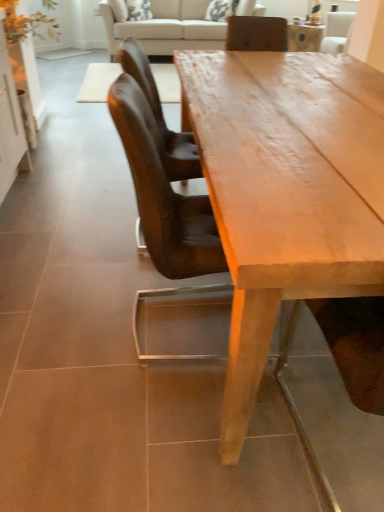
What do you see at coordinates (164, 27) in the screenshot? I see `beige fabric couch at upper center` at bounding box center [164, 27].

What do you see at coordinates (161, 116) in the screenshot? The width and height of the screenshot is (384, 512). I see `leather chair at center, which appears as the 2th chair when viewed from the front` at bounding box center [161, 116].

Describe the element at coordinates (10, 124) in the screenshot. I see `white glossy cabinet at left` at that location.

Locate an element on the screen. This screenshot has width=384, height=512. beige fabric couch at upper center is located at coordinates (164, 27).

Who is shorter, smooth wooden table at center or white glossy cabinet at left?

Standing shorter between the two is smooth wooden table at center.

This screenshot has width=384, height=512. What are the coordinates of `cabinetry above the smooth wooden table at center (from the image's perspective)` in the screenshot? It's located at (10, 124).

Considering the sizes of smooth wooden table at center and white glossy cabinet at left in the image, is smooth wooden table at center wider or thinner than white glossy cabinet at left?

In the image, smooth wooden table at center appears to be wider than white glossy cabinet at left.

Considering the relative sizes of smooth wooden table at center and white glossy cabinet at left in the image provided, is smooth wooden table at center smaller than white glossy cabinet at left?

Actually, smooth wooden table at center might be larger than white glossy cabinet at left.

Considering the relative sizes of brown leather chair at center, which is counted as the 1th chair, starting from the front, and leather chair at center, which appears as the 2th chair when viewed from the front, in the image provided, is brown leather chair at center, which is counted as the 1th chair, starting from the front, wider than leather chair at center, which appears as the 2th chair when viewed from the front,?

Incorrect, the width of brown leather chair at center, which is counted as the 1th chair, starting from the front, does not surpass that of leather chair at center, which appears as the 2th chair when viewed from the front.

From a real-world perspective, who is located higher, brown leather chair at center, which is counted as the 1th chair, starting from the front, or leather chair at center, positioned as the 1th chair in back-to-front order?

brown leather chair at center, which is counted as the 1th chair, starting from the front, from a real-world perspective.

At what (x,y) coordinates should I click in order to perform the action: click on chair that is on the right side of leather chair at center, positioned as the 1th chair in back-to-front order. Please return your answer as a coordinate pair (x, y). The width and height of the screenshot is (384, 512). Looking at the image, I should click on (163, 193).

Consider the image. Is brown leather chair at center, marked as the second chair in a back-to-front arrangement, in contact with white glossy cabinet at left?

No, brown leather chair at center, marked as the second chair in a back-to-front arrangement, is not beside white glossy cabinet at left.

From the image's perspective, is brown leather chair at center, which is counted as the 1th chair, starting from the front, below white glossy cabinet at left?

Yes.

Looking at their sizes, would you say brown leather chair at center, marked as the second chair in a back-to-front arrangement, is wider or thinner than white glossy cabinet at left?

Considering their sizes, brown leather chair at center, marked as the second chair in a back-to-front arrangement, looks broader than white glossy cabinet at left.

Is white glossy cabinet at left completely or partially inside brown leather chair at center, which is counted as the 1th chair, starting from the front?

No, white glossy cabinet at left is not a part of brown leather chair at center, which is counted as the 1th chair, starting from the front.

Can we say leather chair at center, positioned as the 1th chair in back-to-front order, lies outside brown leather chair at center, marked as the second chair in a back-to-front arrangement?

Yes.

Looking at this image, from a real-world perspective, which object rests below the other?

leather chair at center, which appears as the 2th chair when viewed from the front.

Is leather chair at center, which appears as the 2th chair when viewed from the front, placed right next to brown leather chair at center, which is counted as the 1th chair, starting from the front?

There is a gap between leather chair at center, which appears as the 2th chair when viewed from the front, and brown leather chair at center, which is counted as the 1th chair, starting from the front.

Considering the sizes of objects leather chair at center, positioned as the 1th chair in back-to-front order, and brown leather chair at center, marked as the second chair in a back-to-front arrangement, in the image provided, who is bigger, leather chair at center, positioned as the 1th chair in back-to-front order, or brown leather chair at center, marked as the second chair in a back-to-front arrangement,?

With larger size is brown leather chair at center, marked as the second chair in a back-to-front arrangement.

From a real-world perspective, is beige fabric couch at upper center under white glossy cabinet at left?

Yes, from a real-world perspective, beige fabric couch at upper center is under white glossy cabinet at left.

Consider the image. Is beige fabric couch at upper center further to camera compared to white glossy cabinet at left?

Yes, beige fabric couch at upper center is further from the viewer.

Considering the sizes of objects beige fabric couch at upper center and white glossy cabinet at left in the image provided, who is bigger, beige fabric couch at upper center or white glossy cabinet at left?

With larger size is beige fabric couch at upper center.

Is beige fabric couch at upper center turned away from white glossy cabinet at left?

No, white glossy cabinet at left is not at the back of beige fabric couch at upper center.

From a real-world perspective, is leather chair at center, which appears as the 2th chair when viewed from the front, over beige fabric couch at upper center?

Yes, from a real-world perspective, leather chair at center, which appears as the 2th chair when viewed from the front, is above beige fabric couch at upper center.

Considering the positions of points (143, 57) and (220, 28), is point (143, 57) closer to camera compared to point (220, 28)?

Yes.

Do you think leather chair at center, positioned as the 1th chair in back-to-front order, is within beige fabric couch at upper center, or outside of it?

leather chair at center, positioned as the 1th chair in back-to-front order, lies outside beige fabric couch at upper center.

Who is smaller, leather chair at center, which appears as the 2th chair when viewed from the front, or beige fabric couch at upper center?

leather chair at center, which appears as the 2th chair when viewed from the front, is smaller.

From a real-world perspective, is leather chair at center, positioned as the 1th chair in back-to-front order, positioned under smooth wooden table at center based on gravity?

No, from a real-world perspective, leather chair at center, positioned as the 1th chair in back-to-front order, is not below smooth wooden table at center.

Is smooth wooden table at center a part of leather chair at center, which appears as the 2th chair when viewed from the front?

Definitely not — smooth wooden table at center is not inside leather chair at center, which appears as the 2th chair when viewed from the front.

How much distance is there between leather chair at center, positioned as the 1th chair in back-to-front order, and smooth wooden table at center?

leather chair at center, positioned as the 1th chair in back-to-front order, is 19.73 inches away from smooth wooden table at center.

Which of these two, leather chair at center, positioned as the 1th chair in back-to-front order, or smooth wooden table at center, is smaller?

leather chair at center, positioned as the 1th chair in back-to-front order.

Locate an element on the screen. cabinetry on the left of smooth wooden table at center is located at coordinates (10, 124).

Locate an element on the screen. The width and height of the screenshot is (384, 512). chair located above the brown leather chair at center, which is counted as the 1th chair, starting from the front (from the image's perspective) is located at coordinates (161, 116).

Looking at the image, which one is located further to white glossy cabinet at left, leather chair at center, positioned as the 1th chair in back-to-front order, or smooth wooden table at center?

smooth wooden table at center.

When comparing their distances from white glossy cabinet at left, does brown leather chair at center, marked as the second chair in a back-to-front arrangement, or beige fabric couch at upper center seem further?

beige fabric couch at upper center is positioned further to the anchor white glossy cabinet at left.

From the image, which object appears to be nearer to smooth wooden table at center, white glossy cabinet at left or leather chair at center, which appears as the 2th chair when viewed from the front?

leather chair at center, which appears as the 2th chair when viewed from the front, is closer to smooth wooden table at center.

Estimate the real-world distances between objects in this image. Which object is closer to smooth wooden table at center, leather chair at center, which appears as the 2th chair when viewed from the front, or white glossy cabinet at left?

leather chair at center, which appears as the 2th chair when viewed from the front, is positioned closer to the anchor smooth wooden table at center.

Looking at the image, which one is located further to brown leather chair at center, marked as the second chair in a back-to-front arrangement, leather chair at center, which appears as the 2th chair when viewed from the front, or white glossy cabinet at left?

white glossy cabinet at left lies further to brown leather chair at center, marked as the second chair in a back-to-front arrangement, than the other object.

From the image, which object appears to be nearer to smooth wooden table at center, brown leather chair at center, marked as the second chair in a back-to-front arrangement, or beige fabric couch at upper center?

The object closer to smooth wooden table at center is brown leather chair at center, marked as the second chair in a back-to-front arrangement.

From the image, which object appears to be nearer to white glossy cabinet at left, beige fabric couch at upper center or leather chair at center, which appears as the 2th chair when viewed from the front?

leather chair at center, which appears as the 2th chair when viewed from the front, is closer to white glossy cabinet at left.

From the image, which object appears to be nearer to brown leather chair at center, marked as the second chair in a back-to-front arrangement, smooth wooden table at center or beige fabric couch at upper center?

smooth wooden table at center lies closer to brown leather chair at center, marked as the second chair in a back-to-front arrangement, than the other object.

At what (x,y) coordinates should I click in order to perform the action: click on chair between smooth wooden table at center and leather chair at center, which appears as the 2th chair when viewed from the front, in the front-back direction. Please return your answer as a coordinate pair (x, y). This screenshot has width=384, height=512. Looking at the image, I should click on (163, 193).

Where is `chair between white glossy cabinet at left and brown leather chair at center, marked as the second chair in a back-to-front arrangement, in the horizontal direction`? This screenshot has height=512, width=384. chair between white glossy cabinet at left and brown leather chair at center, marked as the second chair in a back-to-front arrangement, in the horizontal direction is located at coordinates (161, 116).

At what (x,y) coordinates should I click in order to perform the action: click on chair between brown leather chair at center, which is counted as the 1th chair, starting from the front, and beige fabric couch at upper center, along the z-axis. Please return your answer as a coordinate pair (x, y). The width and height of the screenshot is (384, 512). Looking at the image, I should click on (161, 116).

Locate an element on the screen. Image resolution: width=384 pixels, height=512 pixels. cabinetry located between leather chair at center, which appears as the 2th chair when viewed from the front, and beige fabric couch at upper center in the depth direction is located at coordinates (x=10, y=124).